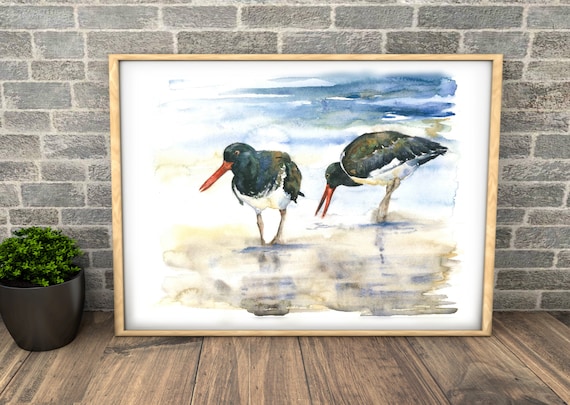
Locate an element on the screen. The height and width of the screenshot is (405, 570). brick wall is located at coordinates (540, 83).